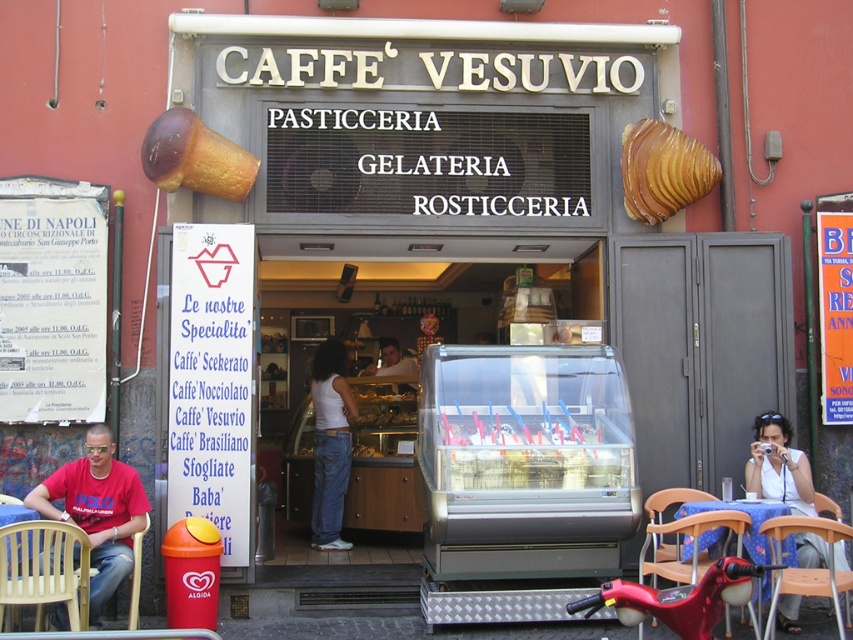
Who is more distant from viewer, [166,177] or [750,520]?

Point [166,177]

Is point (190, 134) behind point (680, 493)?

No, it is not.

Where is `brown textured ice cream cone at upper left`? brown textured ice cream cone at upper left is located at coordinates (195, 157).

Is translucent plastic ice cream cones at center above brown textured ice cream cone at upper left?

No, translucent plastic ice cream cones at center is not above brown textured ice cream cone at upper left.

Can you confirm if translucent plastic ice cream cones at center is thinner than brown textured ice cream cone at upper left?

In fact, translucent plastic ice cream cones at center might be wider than brown textured ice cream cone at upper left.

At what (x,y) coordinates should I click in order to perform the action: click on translucent plastic ice cream cones at center. Please return your answer as a coordinate pair (x, y). Looking at the image, I should click on (532, 467).

Is translucent plastic ice cream cones at center further to the viewer compared to wooden chair at lower right?

Yes, it is.

Is point (630, 461) positioned before point (676, 563)?

That is False.

Find the location of `translucent plastic ice cream cones at center`. translucent plastic ice cream cones at center is located at coordinates (532, 467).